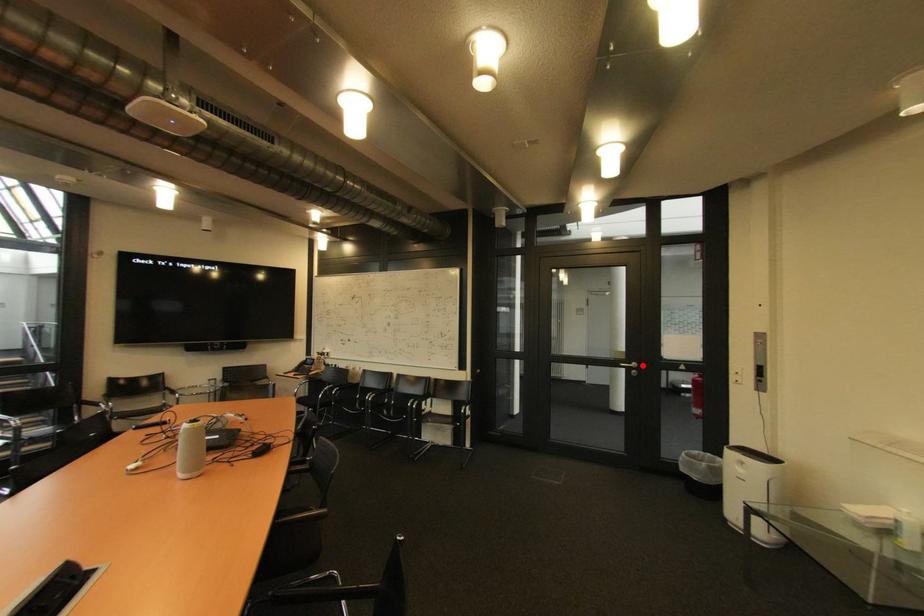
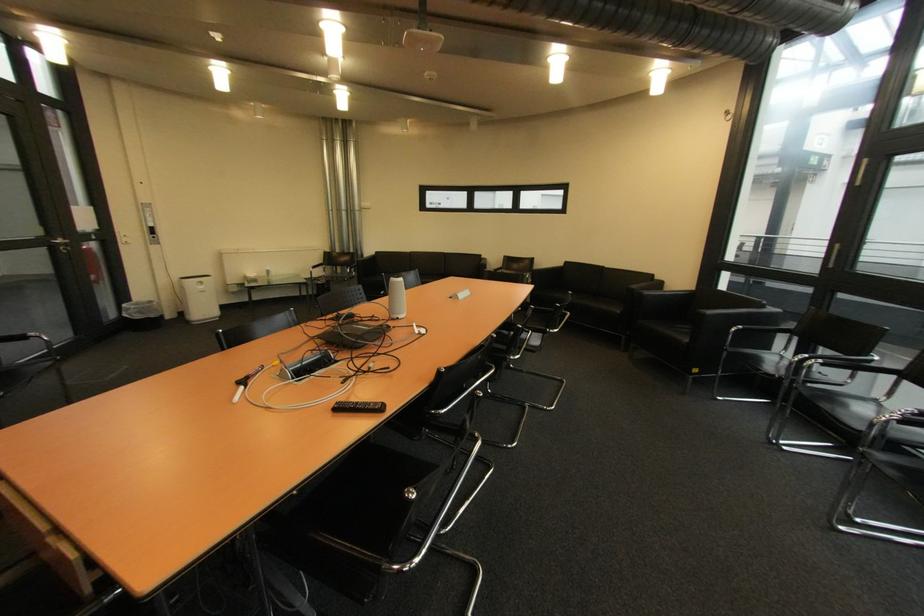
In the second image, find the point that corresponds to the highlighted location in the first image.

(68, 241)